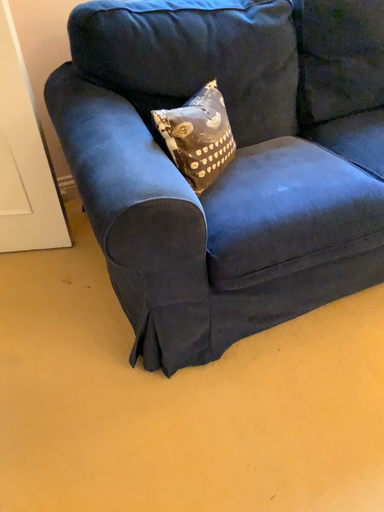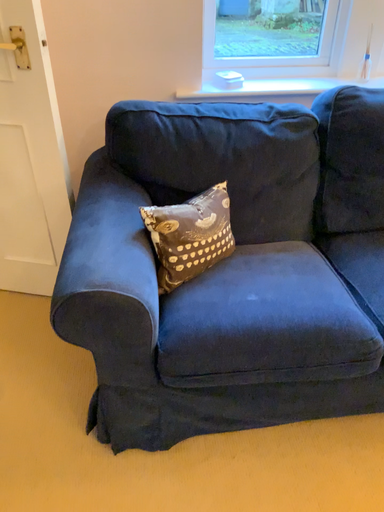
Question: How did the camera likely rotate when shooting the video?

Choices:
 (A) rotated upward
 (B) rotated downward

Answer: (A)